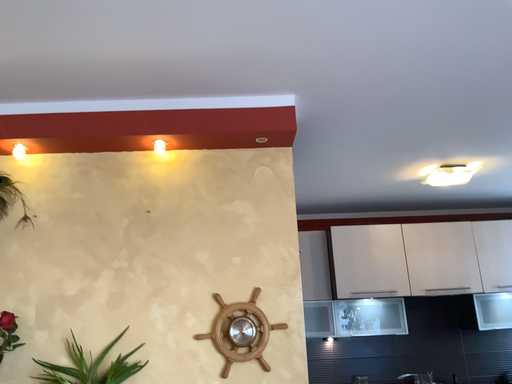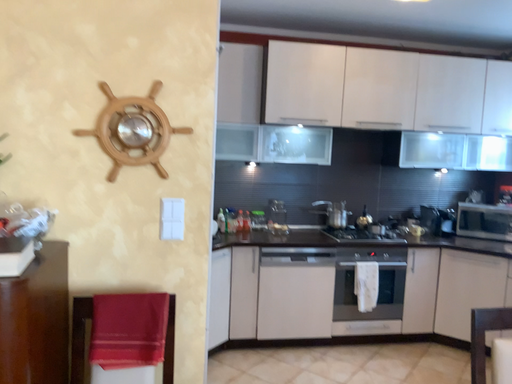
Question: How did the camera likely rotate when shooting the video?

Choices:
 (A) rotated left
 (B) rotated right

Answer: (B)